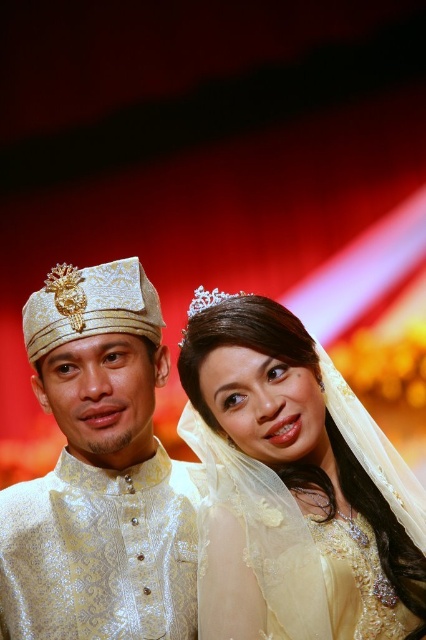
You are a photographer standing at a certain distance from the matte gold veil at center. You need to capture a closeup shot of the veil without using a zoom lens. What is the minimum distance you should move closer to ensure the veil fills the frame?

The minimum distance you should move closer is 0.24 meters, bringing you to 1.00 meters away from the matte gold veil at center to achieve the desired closeup without zoom.

You are a photographer at a wedding and need to adjust the lighting to ensure both the matte gold veil at center and the clear crystal tiara at center are visible. Given their sizes, which object might require more focused lighting to prevent it from being overshadowed?

The clear crystal tiara at center is smaller than the matte gold veil at center, so it might require more focused lighting to ensure it doesn

You are a photographer at a wedding and need to adjust the lighting to ensure both the matte gold veil at center and the clear crystal tiara at upper center are well illuminated. Given their positions and sizes, which object should you focus the light on first to account for their size difference?

The matte gold veil at center has a greater height compared to the clear crystal tiara at upper center, so you should focus the light on the matte gold veil at center first due to its larger size to ensure proper illumination.